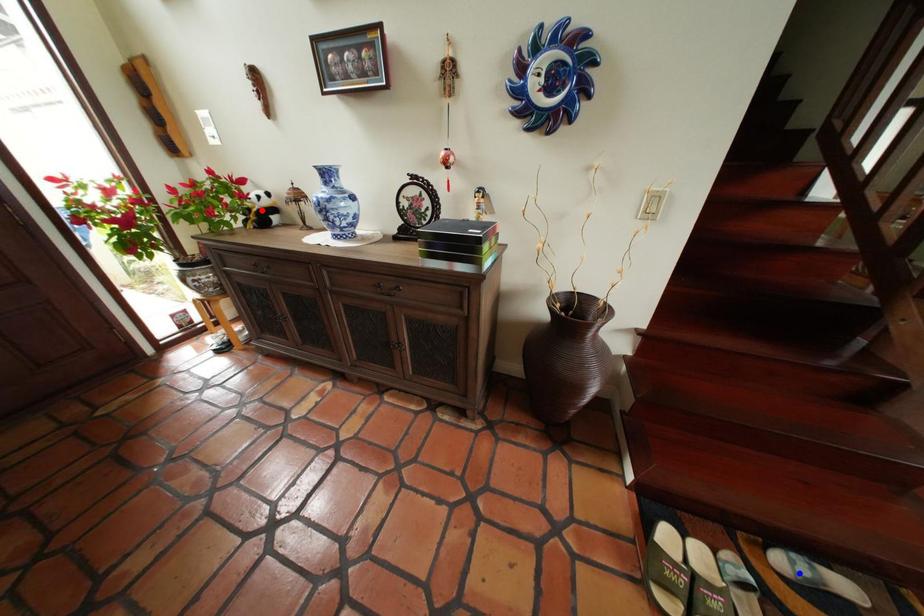
Question: Two points are marked on the image. Which point is closer to the camera?

Choices:
 (A) Blue point is closer.
 (B) Red point is closer.

Answer: (A)